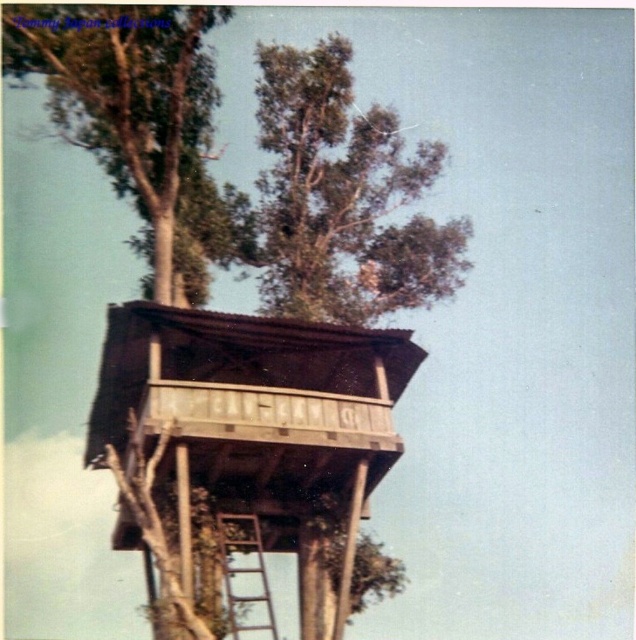
You are a visitor trying to reach the treehouse. You see the wooden ladder at center and the green leafy tree at upper center. Which object is closer to you?

The wooden ladder at center is behind the green leafy tree at upper center, so the green leafy tree at upper center is closer to you.